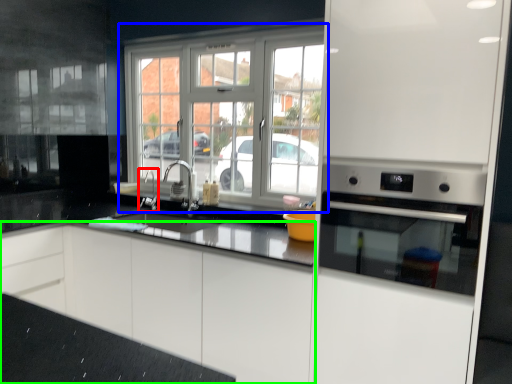
Question: Based on their relative distances, which object is nearer to faucet (highlighted by a red box)? Choose from window (highlighted by a blue box) and cabinetry (highlighted by a green box).

Choices:
 (A) window
 (B) cabinetry

Answer: (A)